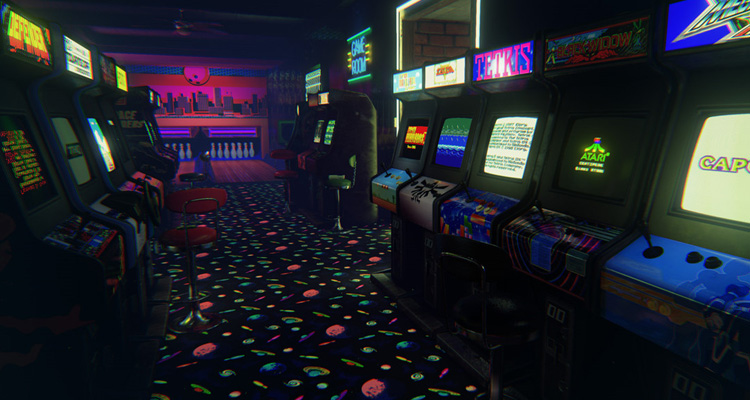
At what (x,y) coordinates should I click in order to perform the action: click on door lighting. Please return your answer as a coordinate pair (x, y). The height and width of the screenshot is (400, 750). Looking at the image, I should click on (399, 19), (477, 31), (394, 50).